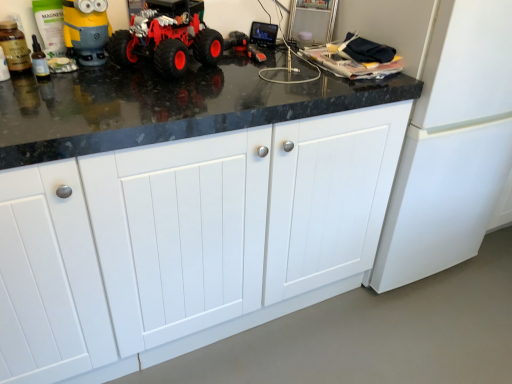
Locate an element on the screen. white matte cabinet at center is located at coordinates pyautogui.click(x=186, y=239).

Describe the element at coordinates (186, 239) in the screenshot. I see `white matte cabinet at center` at that location.

You are a GUI agent. You are given a task and a screenshot of the screen. Output one action in this format:
    pyautogui.click(x=<x>, y=<y>)
    Task: Click on the red rubber toy truck at center
    
    Given the screenshot: What is the action you would take?
    pyautogui.click(x=167, y=38)

Image resolution: width=512 pixels, height=384 pixels. What do you see at coordinates (167, 38) in the screenshot?
I see `red rubber toy truck at center` at bounding box center [167, 38].

Measure the distance between red rubber toy truck at center and camera.

They are 1.17 meters apart.

Identify the location of white matte cabinet at center. (186, 239).

Considering the positions of objects white matte cabinet at center and red rubber toy truck at center in the image provided, who is more to the right, white matte cabinet at center or red rubber toy truck at center?

white matte cabinet at center is more to the right.

Which is behind, white matte cabinet at center or red rubber toy truck at center?

red rubber toy truck at center is further away from the camera.

Between point (136, 220) and point (117, 54), which one is positioned behind?

The point (117, 54) is more distant.

From the image's perspective, which is below, white matte cabinet at center or red rubber toy truck at center?

white matte cabinet at center.

From a real-world perspective, who is located lower, white matte cabinet at center or red rubber toy truck at center?

white matte cabinet at center, from a real-world perspective.

Which of these two, white matte cabinet at center or red rubber toy truck at center, is wider?

white matte cabinet at center.

Between white matte cabinet at center and red rubber toy truck at center, which one has more height?

white matte cabinet at center.

In terms of size, does white matte cabinet at center appear bigger or smaller than red rubber toy truck at center?

In the image, white matte cabinet at center appears to be larger than red rubber toy truck at center.

Is red rubber toy truck at center inside white matte cabinet at center?

Definitely not — red rubber toy truck at center is not inside white matte cabinet at center.

Is white matte cabinet at center beside red rubber toy truck at center?

No, white matte cabinet at center is not beside red rubber toy truck at center.

Is red rubber toy truck at center at the back of white matte cabinet at center?

white matte cabinet at center is not turned away from red rubber toy truck at center.

Looking at this image, can you tell me how much white matte cabinet at center and red rubber toy truck at center differ in facing direction?

The facing directions of white matte cabinet at center and red rubber toy truck at center are 39.7 degrees apart.

How much distance is there between white matte cabinet at center and red rubber toy truck at center?

The distance of white matte cabinet at center from red rubber toy truck at center is 21.07 inches.

Image resolution: width=512 pixels, height=384 pixels. What are the coordinates of `land vehicle that appears above the white matte cabinet at center (from the image's perspective)` in the screenshot? It's located at (167, 38).

Between red rubber toy truck at center and white matte cabinet at center, which one appears on the left side from the viewer's perspective?

Positioned to the left is red rubber toy truck at center.

Is red rubber toy truck at center closer to the viewer compared to white matte cabinet at center?

No, it is not.

Does point (201, 55) lie in front of point (357, 270)?

Yes.

From the image's perspective, is red rubber toy truck at center on top of white matte cabinet at center?

Yes, from the image's perspective, red rubber toy truck at center is above white matte cabinet at center.

From a real-world perspective, which is physically above, red rubber toy truck at center or white matte cabinet at center?

In real-world perspective, red rubber toy truck at center is above.

Can you confirm if red rubber toy truck at center is thinner than white matte cabinet at center?

Yes, red rubber toy truck at center is thinner than white matte cabinet at center.

Between red rubber toy truck at center and white matte cabinet at center, which one has more height?

Standing taller between the two is white matte cabinet at center.

In the scene shown: Considering the relative sizes of red rubber toy truck at center and white matte cabinet at center in the image provided, is red rubber toy truck at center smaller than white matte cabinet at center?

Yes, red rubber toy truck at center is smaller than white matte cabinet at center.

From the picture: Is red rubber toy truck at center not within white matte cabinet at center?

Yes, red rubber toy truck at center is located beyond the bounds of white matte cabinet at center.

Is red rubber toy truck at center with white matte cabinet at center?

No, red rubber toy truck at center is not next to white matte cabinet at center.

Is red rubber toy truck at center facing towards white matte cabinet at center?

No, red rubber toy truck at center is not aimed at white matte cabinet at center.

Identify the location of land vehicle that appears on the left of white matte cabinet at center. This screenshot has height=384, width=512. (167, 38).

The height and width of the screenshot is (384, 512). Find the location of `cabinetry on the right of red rubber toy truck at center`. cabinetry on the right of red rubber toy truck at center is located at coordinates (186, 239).

Identify the location of cabinetry below the red rubber toy truck at center (from the image's perspective). (186, 239).